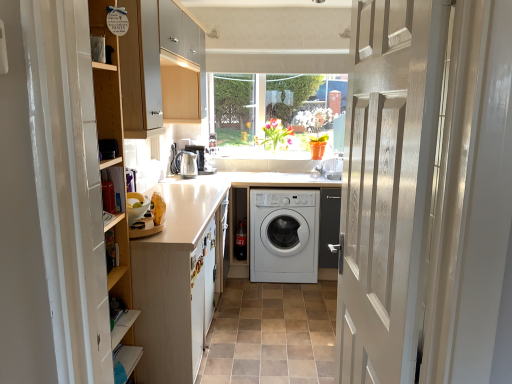
Question: From the image's perspective, is white wood door at center located above or below white matte washer at center?

Choices:
 (A) above
 (B) below

Answer: (A)

Question: From a real-world perspective, is white wood door at center physically located above or below white matte washer at center?

Choices:
 (A) above
 (B) below

Answer: (A)

Question: Which is farther from the white matte washing machine at center?

Choices:
 (A) white wood door at center
 (B) satin silver kettle at center
 (C) white matte cabinet at left
 (D) white matte washer at center

Answer: (A)

Question: Considering the real-world distances, which object is closest to the satin silver kettle at center?

Choices:
 (A) white matte cabinet at left
 (B) white matte washer at center
 (C) white wood door at center
 (D) white matte washing machine at center

Answer: (D)